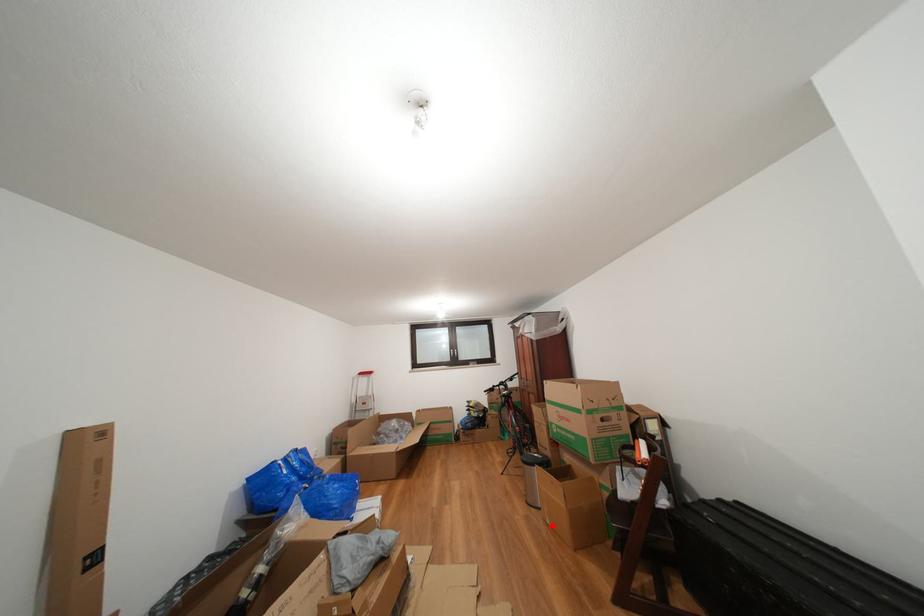
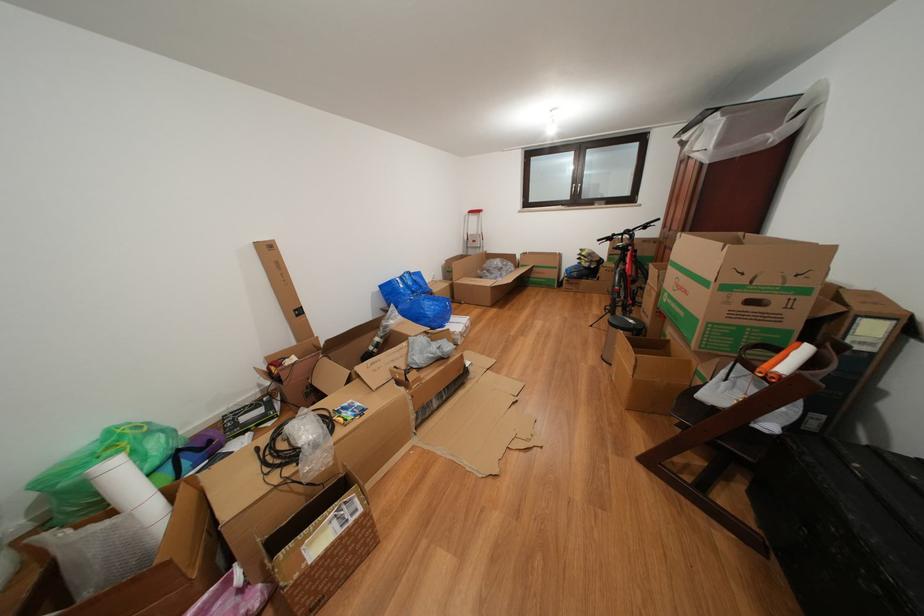
Locate, in the second image, the point that corresponds to the highlighted location in the first image.

(619, 382)